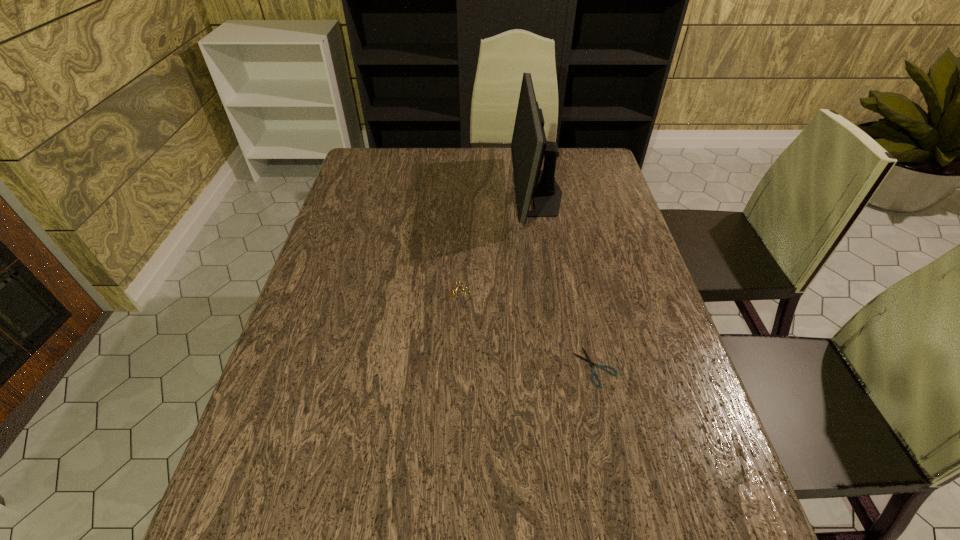
This screenshot has width=960, height=540. In order to click on blank area in the image that satisfies the following two spatial constraints: 1. on the screen side of the nearest object; 2. on the right side of the farthest object in this screenshot , I will do `click(565, 367)`.

Find the location of a particular element. Image resolution: width=960 pixels, height=540 pixels. vacant space that satisfies the following two spatial constraints: 1. on the screen side of the shorter shears; 2. on the right side of the tallest object is located at coordinates (565, 367).

Find the location of a particular element. free space in the image that satisfies the following two spatial constraints: 1. on the screen side of the computer monitor; 2. on the back side of the shortest object is located at coordinates (565, 367).